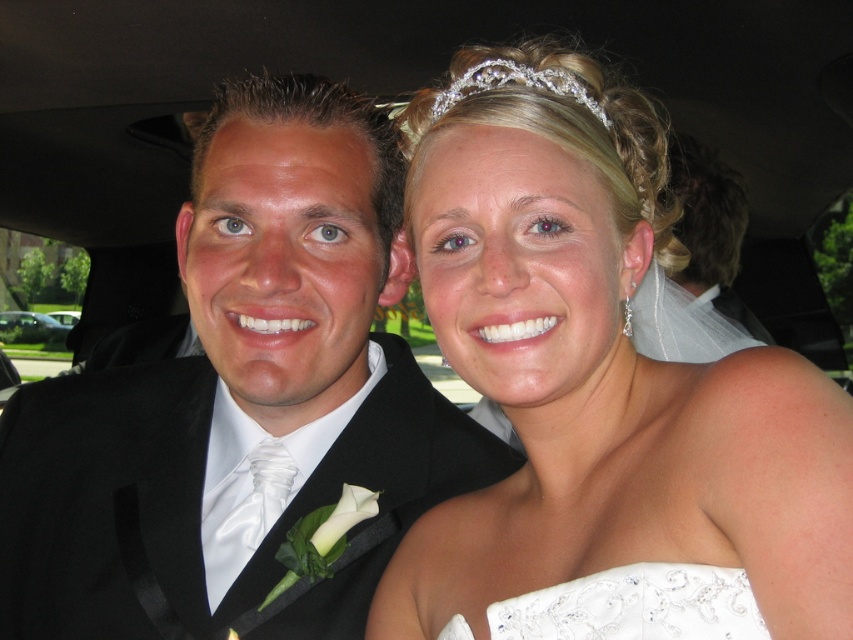
You are a photographer standing at the back of the car. You want to ensure the white satin dress at upper right is visible in the photo. Is the point at coordinates point [605,397] obstructed by any part of the groom in the left?

The point at coordinates point [605,397] is not obstructed by the groom in the left because the white satin dress at upper right is located at that point, implying it is visible and not blocked by the groom.

You are a photographer taking a photo of the white satin dress at upper right and the clear crystal tiara at upper center. Based on their positions, which object is closer to the camera?

The white satin dress at upper right is closer to the camera because it is in front of the clear crystal tiara at upper center.